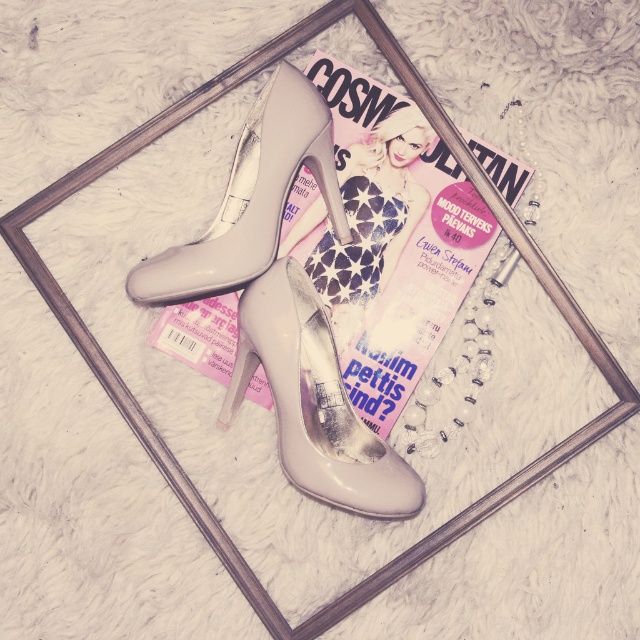
You are arranging items on a shelf and need to place the matte pink magazine at center. Where should you position it relative to the high heeled shoes?

The matte pink magazine at center is located at point (392, 241), so you should position it to the right of the high heeled shoes.

You are a photographer setting up a shoot. You need to adjust the lighting so that the matte pink magazine at center and the matte plastic barbie at center are both clearly visible. Which object should you focus the light on first to ensure it isn

The matte pink magazine at center is in front of the matte plastic barbie at center. Therefore, you should focus the light on the matte pink magazine at center first to ensure it is clearly visible before adjusting for the one behind it.